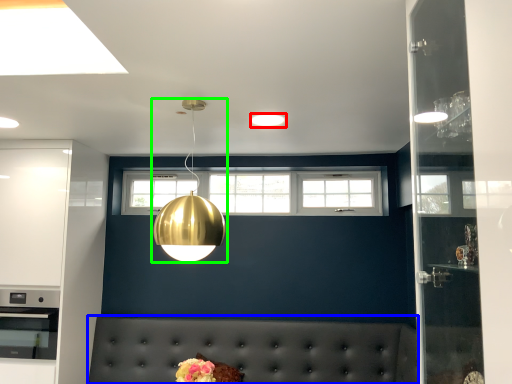
Question: Based on their relative distances, which object is farther from lighting (highlighted by a red box)? Choose from couch (highlighted by a blue box) and lamp (highlighted by a green box).

Choices:
 (A) couch
 (B) lamp

Answer: (A)